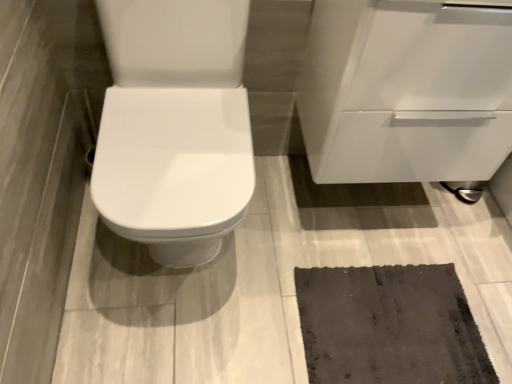
Question: Considering the positions of dark gray textured mat at lower right and white glossy cabinet at upper right in the image, is dark gray textured mat at lower right wider or thinner than white glossy cabinet at upper right?

Choices:
 (A) thin
 (B) wide

Answer: (A)

Question: Does point (424, 349) appear closer or farther from the camera than point (310, 170)?

Choices:
 (A) farther
 (B) closer

Answer: (B)

Question: Is dark gray textured mat at lower right in front of or behind white glossy cabinet at upper right in the image?

Choices:
 (A) behind
 (B) front

Answer: (A)

Question: Considering the positions of white glossy cabinet at upper right and dark gray textured mat at lower right in the image, is white glossy cabinet at upper right bigger or smaller than dark gray textured mat at lower right?

Choices:
 (A) big
 (B) small

Answer: (A)

Question: Is white glossy cabinet at upper right wider or thinner than dark gray textured mat at lower right?

Choices:
 (A) wide
 (B) thin

Answer: (A)

Question: From the image's perspective, relative to dark gray textured mat at lower right, is white glossy cabinet at upper right above or below?

Choices:
 (A) above
 (B) below

Answer: (A)

Question: Is white glossy cabinet at upper right inside or outside of dark gray textured mat at lower right?

Choices:
 (A) inside
 (B) outside

Answer: (B)